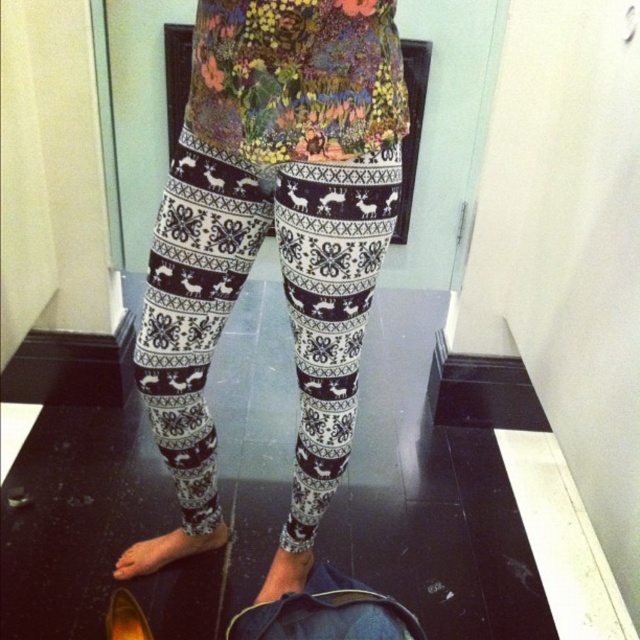
Consider the image. Is white printed leggings at center thinner than gold metallic shoe at lower left?

In fact, white printed leggings at center might be wider than gold metallic shoe at lower left.

How far apart are white printed leggings at center and gold metallic shoe at lower left?

white printed leggings at center and gold metallic shoe at lower left are 21.55 inches apart.

Who is more forward, (304, 292) or (116, 616)?

Point (304, 292) is in front.

Find the location of a particular element. The height and width of the screenshot is (640, 640). white printed leggings at center is located at coordinates (285, 300).